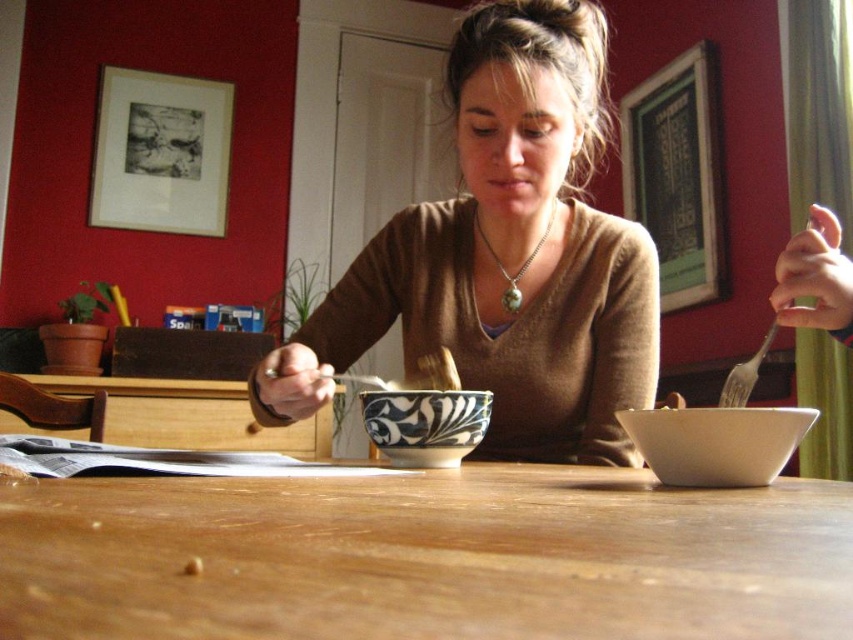
You are arranging items on a table and need to know which object takes up more space. Which item should you consider for placement first, the white matte bowl at center or the green stone necklace at center?

The green stone necklace at center occupies more space than the white matte bowl at center, so you should consider placing it first to ensure enough space is available.

You are a guest in this dining area and want to place a small gift on the wooden table at center without blocking the green stone necklace at center. Where should you place the gift?

The wooden table at center is positioned on the left side of the green stone necklace at center, so placing the gift on the left side of the wooden table at center would avoid blocking the necklace.